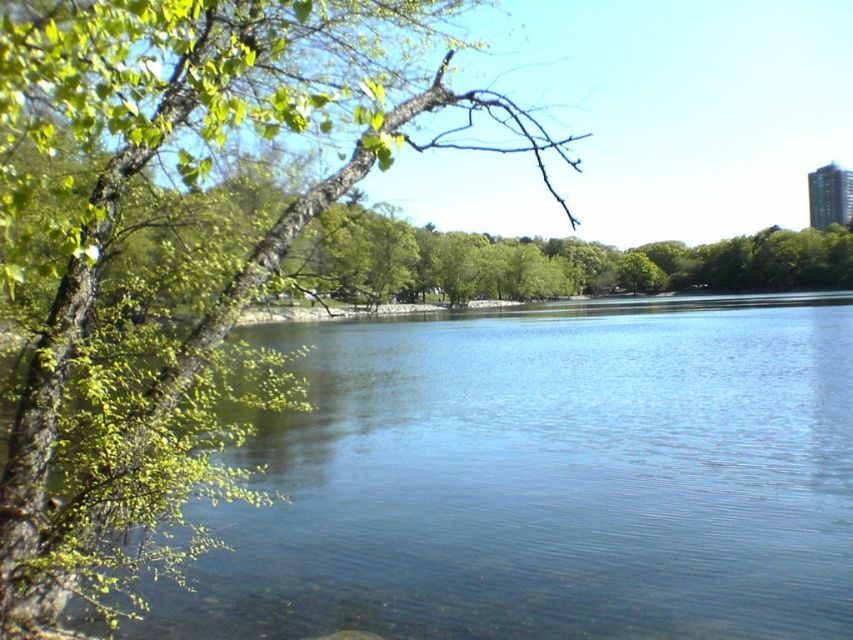
Question: Is clear blue water at left positioned before green leafy branch at left?

Choices:
 (A) no
 (B) yes

Answer: (A)

Question: Which of the following is the closest to the observer?

Choices:
 (A) (222, 579)
 (B) (384, 93)

Answer: (B)

Question: Is clear blue water at left closer to the viewer compared to green leafy branch at left?

Choices:
 (A) no
 (B) yes

Answer: (A)

Question: Does clear blue water at left have a smaller size compared to green leafy branch at left?

Choices:
 (A) no
 (B) yes

Answer: (B)